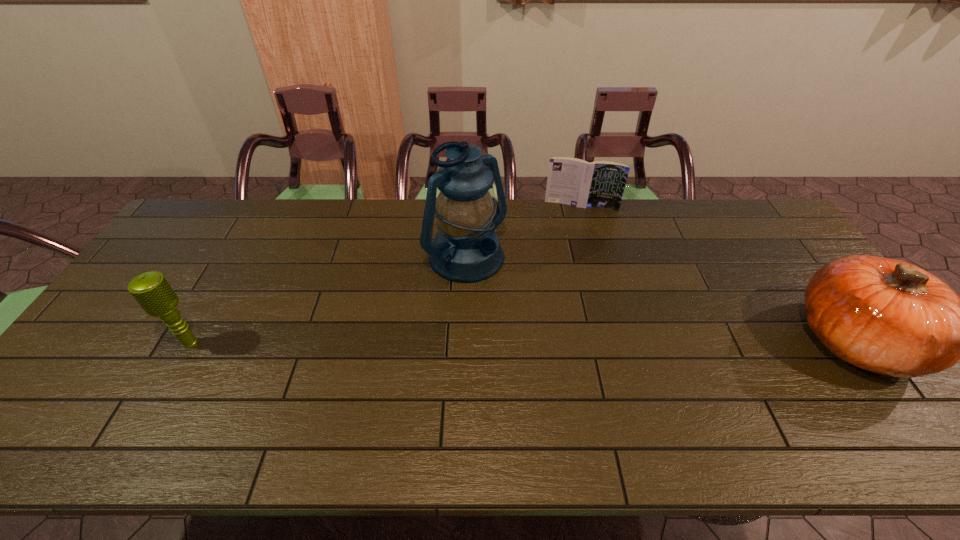
This screenshot has height=540, width=960. Find the location of `empty space that is in between the second object from right to left and the microphone`. empty space that is in between the second object from right to left and the microphone is located at coordinates (386, 274).

Locate an element on the screen. unoccupied area between the book and the microphone is located at coordinates (386, 274).

This screenshot has width=960, height=540. What are the coordinates of `the closest object to the third object from right to left` in the screenshot? It's located at (600, 184).

Image resolution: width=960 pixels, height=540 pixels. Find the location of `object that can be found as the third closest to the second object from right to left`. object that can be found as the third closest to the second object from right to left is located at coordinates (151, 290).

Where is `free spot that satisfies the following two spatial constraints: 1. on the back side of the second object from left to right; 2. on the right side of the microphone`? free spot that satisfies the following two spatial constraints: 1. on the back side of the second object from left to right; 2. on the right side of the microphone is located at coordinates (238, 261).

The image size is (960, 540). What are the coordinates of `vacant point that satisfies the following two spatial constraints: 1. on the back side of the microphone; 2. on the left side of the second object from left to right` in the screenshot? It's located at (238, 261).

Locate an element on the screen. This screenshot has height=540, width=960. vacant space that satisfies the following two spatial constraints: 1. on the back side of the tallest object; 2. on the right side of the farthest object is located at coordinates (468, 206).